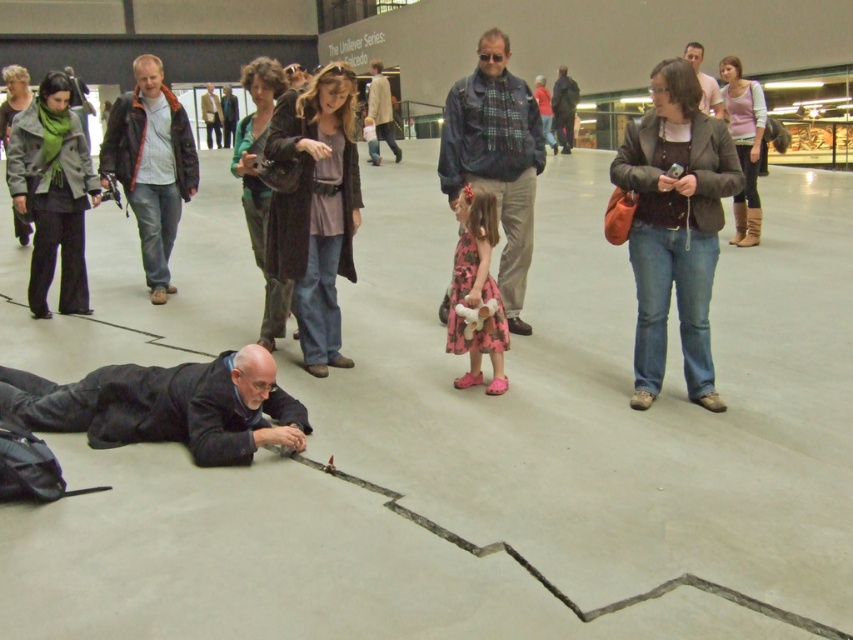
Does point (335, 259) come closer to viewer compared to point (462, 296)?

No.

In the scene shown: Which of these two, denim jeans at center or pink floral dress at center, stands taller?

denim jeans at center is taller.

Is point (305, 266) more distant than point (456, 326)?

That is True.

The height and width of the screenshot is (640, 853). Identify the location of denim jeans at center. (312, 205).

Does dark blue fabric at lower left have a greater height compared to dark blue jacket at center?

No, dark blue fabric at lower left is not taller than dark blue jacket at center.

Is dark blue fabric at lower left behind dark blue jacket at center?

That is False.

At what (x,y) coordinates should I click in order to perform the action: click on dark blue fabric at lower left. Please return your answer as a coordinate pair (x, y). The height and width of the screenshot is (640, 853). Looking at the image, I should click on coord(164,406).

Does dark blue jacket at center have a lesser width compared to brown leather jacket at center?

Correct, dark blue jacket at center's width is less than brown leather jacket at center's.

Between dark blue jacket at center and brown leather jacket at center, which one appears on the left side from the viewer's perspective?

Positioned to the left is brown leather jacket at center.

Does point (486, 113) come farther from viewer compared to point (137, 224)?

No.

Where is `dark blue jacket at center`? Image resolution: width=853 pixels, height=640 pixels. dark blue jacket at center is located at coordinates (496, 157).